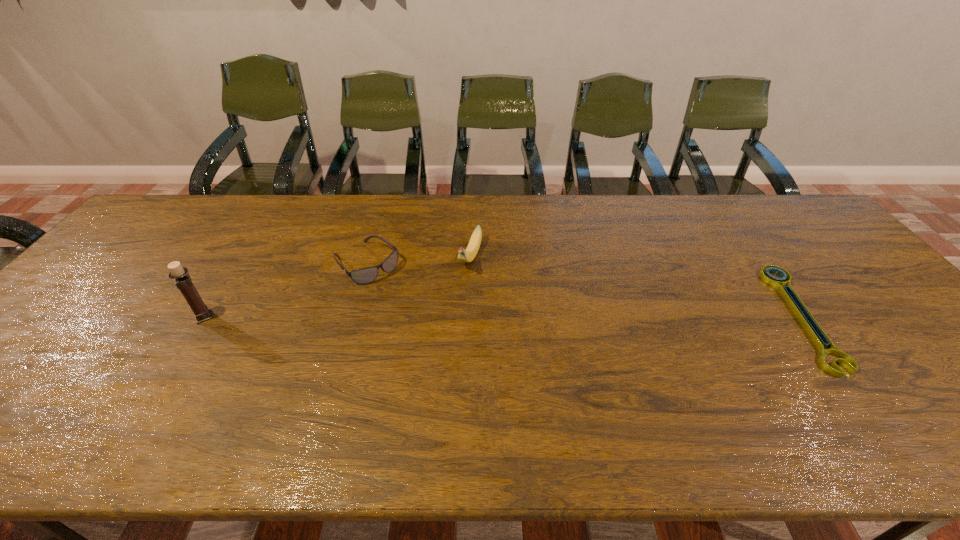
Where is `candle holder`? This screenshot has height=540, width=960. candle holder is located at coordinates (202, 313).

This screenshot has width=960, height=540. I want to click on the leftmost object, so click(x=202, y=313).

You are a GUI agent. You are given a task and a screenshot of the screen. Output one action in this format:
    pyautogui.click(x=<x>, y=<y>)
    Task: Click on the wrench
    The height and width of the screenshot is (540, 960).
    Given the screenshot: What is the action you would take?
    pyautogui.click(x=816, y=333)

Locate an element on the screen. the rightmost object is located at coordinates (816, 333).

At what (x,y) coordinates should I click in order to perform the action: click on banana. Please return your answer as a coordinate pair (x, y). Looking at the image, I should click on (468, 255).

At what (x,y) coordinates should I click in order to perform the action: click on the third shortest object. Please return your answer as a coordinate pair (x, y). The image size is (960, 540). Looking at the image, I should click on (468, 255).

Find the location of a particular element. Image resolution: width=960 pixels, height=540 pixels. the second shortest object is located at coordinates (367, 275).

What are the coordinates of `sunglasses` in the screenshot? It's located at (367, 275).

This screenshot has height=540, width=960. I want to click on vacant space located 0.150m on the left of the candle holder, so click(x=135, y=317).

Where is `free spot located on the left of the rightmost object`? This screenshot has height=540, width=960. free spot located on the left of the rightmost object is located at coordinates (716, 316).